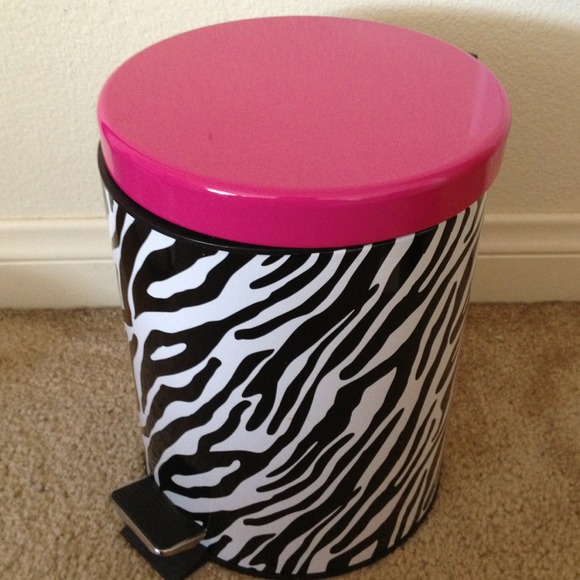
The image size is (580, 580). Identify the location of mechanical foot press to open trash. (143, 523).